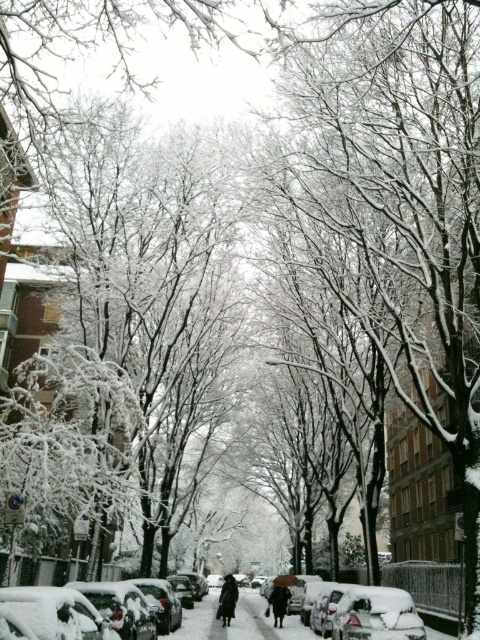
You are standing at the point labeled as point (264, 621) in the image. What object are you standing on?

You are standing on the snow covered car at lower center.